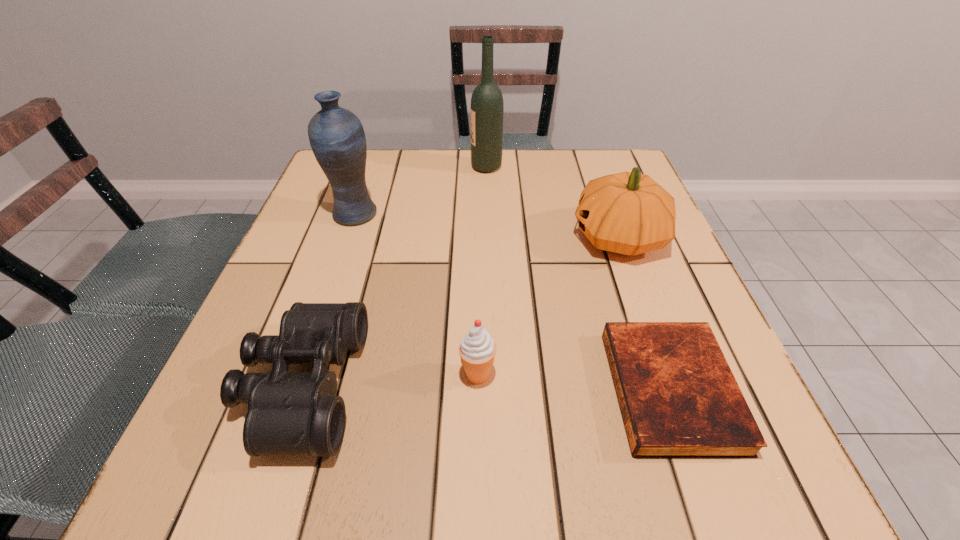
Where is `vacant region located 0.290m on the side of the gourd with the carved face`? vacant region located 0.290m on the side of the gourd with the carved face is located at coordinates (440, 238).

What are the coordinates of `vacant space located on the side of the gourd with the carved face` in the screenshot? It's located at (539, 238).

Where is `blank space located on the side of the gourd with the carved face`? The image size is (960, 540). blank space located on the side of the gourd with the carved face is located at coordinates (512, 238).

What are the coordinates of `free spot located on the right of the fourth tallest object` in the screenshot? It's located at (526, 375).

This screenshot has height=540, width=960. What are the coordinates of `free space located 0.090m at the eyepieces of the second shortest object` in the screenshot? It's located at (412, 386).

The image size is (960, 540). What are the coordinates of `vacant space located 0.260m on the spine side of the Bible` in the screenshot? It's located at (451, 390).

Where is `free location located 0.280m on the spine side of the Bible`? This screenshot has width=960, height=540. free location located 0.280m on the spine side of the Bible is located at coordinates (438, 390).

The height and width of the screenshot is (540, 960). What are the coordinates of `blank area located 0.200m on the spine side of the Bible` in the screenshot? It's located at (489, 390).

Where is `object positioned at the far edge`? The width and height of the screenshot is (960, 540). object positioned at the far edge is located at coordinates (487, 107).

At what (x,y) coordinates should I click in order to perform the action: click on binoculars situated at the near edge. Please return your answer as a coordinate pair (x, y). The width and height of the screenshot is (960, 540). Looking at the image, I should click on (288, 413).